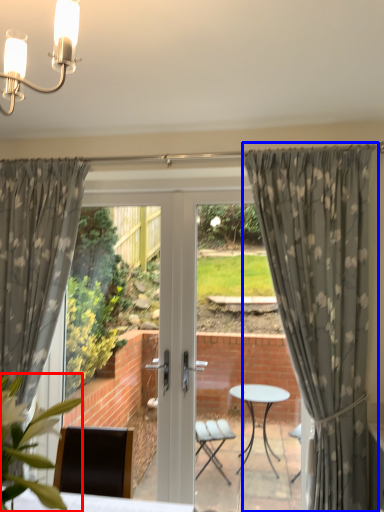
Question: Among these objects, which one is farthest to the camera, plant (highlighted by a red box) or curtain (highlighted by a blue box)?

Choices:
 (A) plant
 (B) curtain

Answer: (B)